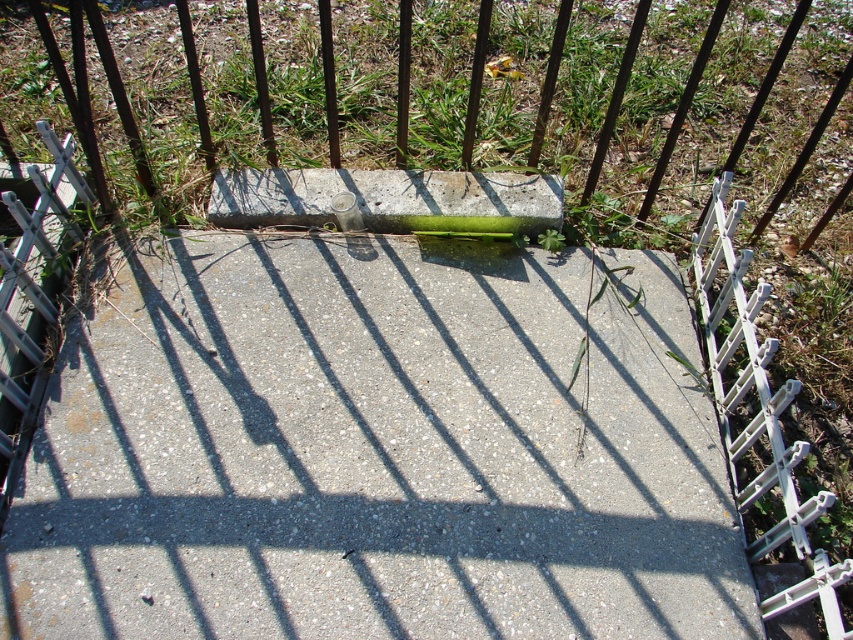
You are standing on the concrete surface in the garden and want to place a small potted plant exactly at the center of the green grass at center. Based on the coordinates provided, where should you place the potted plant?

The green grass at center is located at point coordinates (438, 99), so you should place the potted plant at those coordinates to position it exactly at the center of the green grass at center.

You are standing on the concrete surface in the garden and want to place a small potted plant between the green grass at center and the concreteroughconcrete block at center. Based on their positions, which object should the potted plant be closer to?

The green grass at center is to the right of the concreteroughconcrete block at center, so the potted plant should be placed closer to the concreteroughconcrete block at center to be between them.